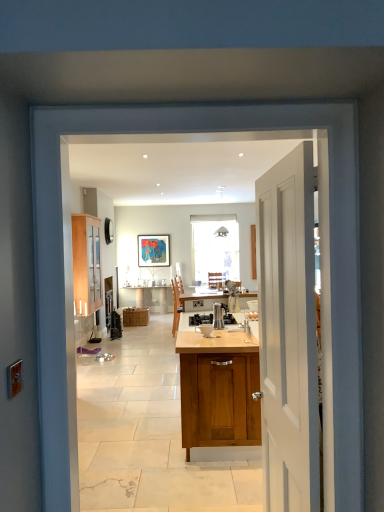
Question: Is metallic stainless steel coffee maker at center wider or thinner than wooden cabinet at left, which is the 2th cabinetry in right-to-left order?

Choices:
 (A) wide
 (B) thin

Answer: (A)

Question: From a real-world perspective, relative to wooden cabinet at left, placed as the second cabinetry when sorted from bottom to top, is metallic stainless steel coffee maker at center vertically above or below?

Choices:
 (A) below
 (B) above

Answer: (A)

Question: Estimate the real-world distances between objects in this image. Which object is closer to the woven wicker basket at center, which appears as the 2th cabinetry when viewed from the front?

Choices:
 (A) white painted wood door at right
 (B) satin silver coffee maker at center
 (C) metallic stainless steel coffee maker at center
 (D) wooden cabinet at left, marked as the second cabinetry in a back-to-front arrangement

Answer: (D)

Question: Considering the real-world distances, which object is farthest from the metallic stainless steel coffee maker at center?

Choices:
 (A) satin silver coffee maker at center
 (B) woven wicker basket at center, acting as the 1th cabinetry starting from the back
 (C) wooden cabinet at left, which ranks as the 1th cabinetry in front-to-back order
 (D) white painted wood door at right

Answer: (B)